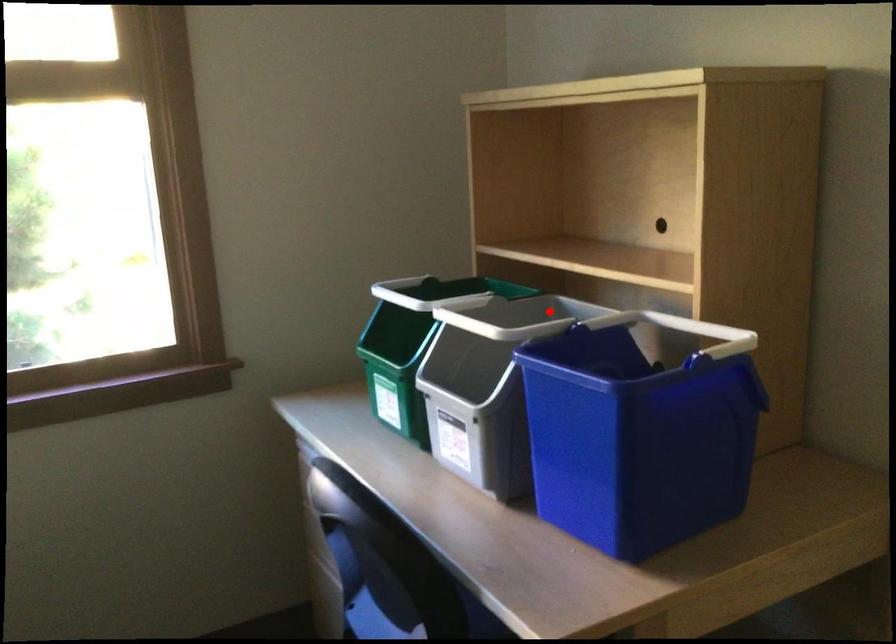
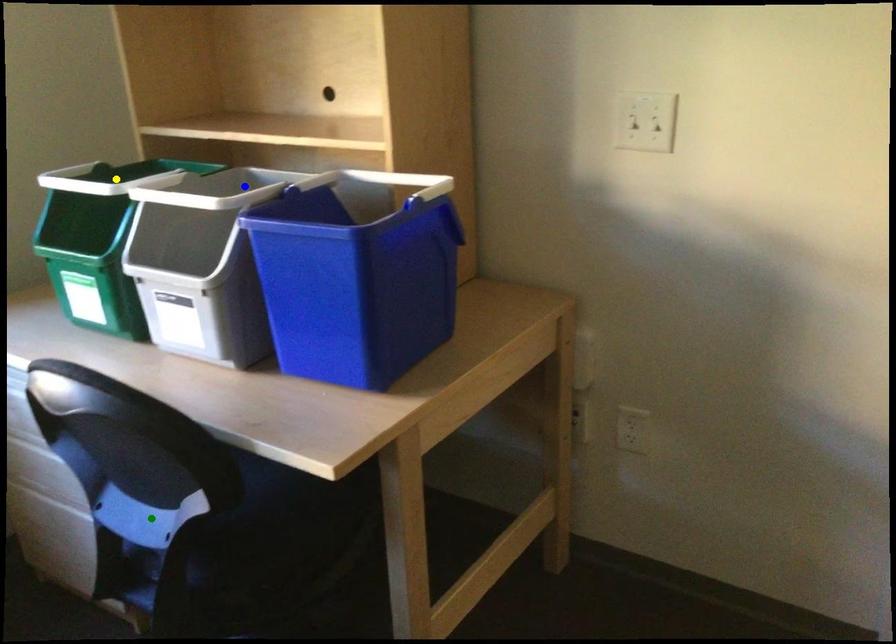
Question: I am providing you with two images of the same scene from different viewpoints. A red point is marked on the first image. You are given multiple points on the second image. Can you choose the point in image 2 that corresponds to the point in image 1?

Choices:
 (A) blue point
 (B) yellow point
 (C) green point

Answer: (A)